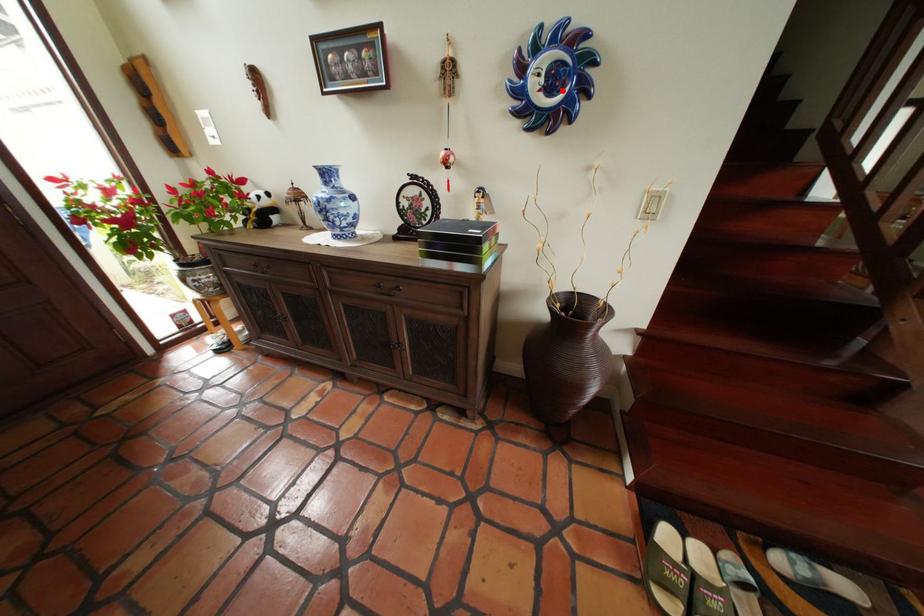
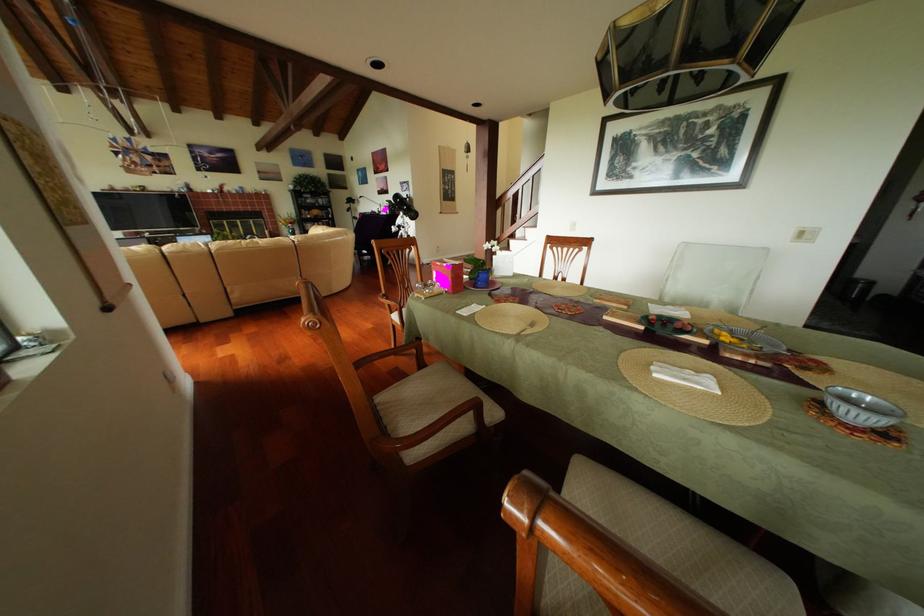
Question: I am providing you with two images of the same scene from different viewpoints. A red point is marked on the first image. Is the red point's position out of view in image 2?

Choices:
 (A) Yes
 (B) No

Answer: (A)